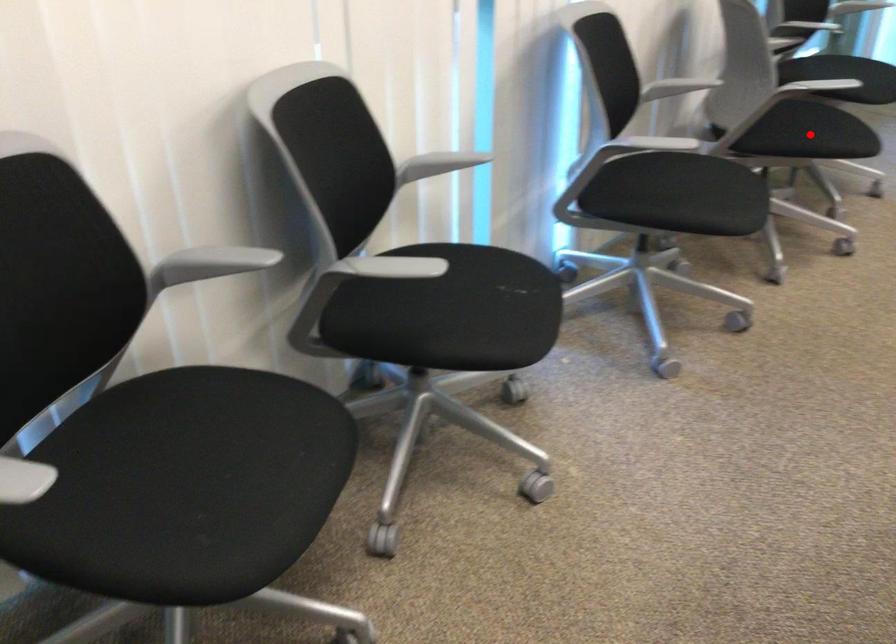
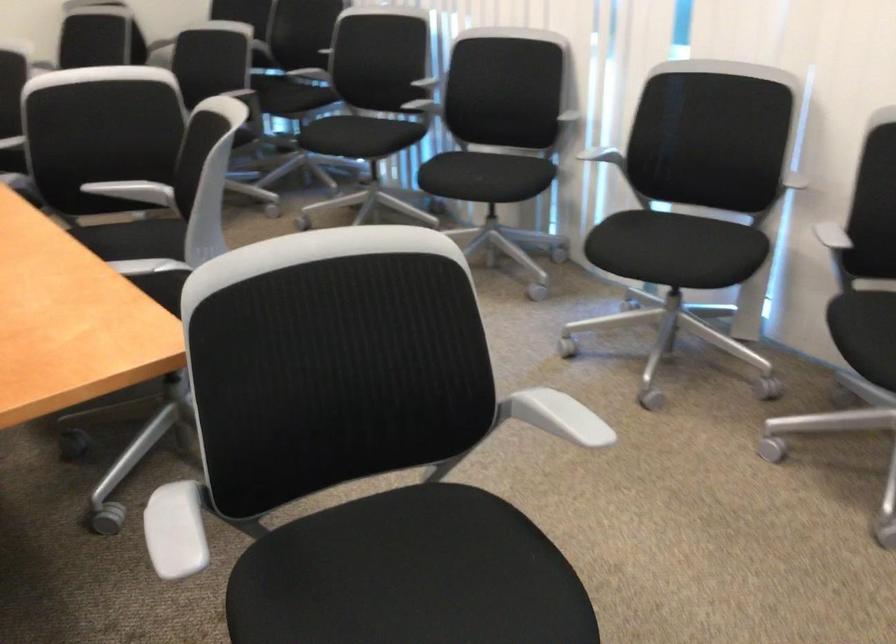
Question: I am providing you with two images of the same scene from different viewpoints. A red point is marked on the first image. Can you still see the location of the red point in image 2?

Choices:
 (A) Yes
 (B) No

Answer: (B)